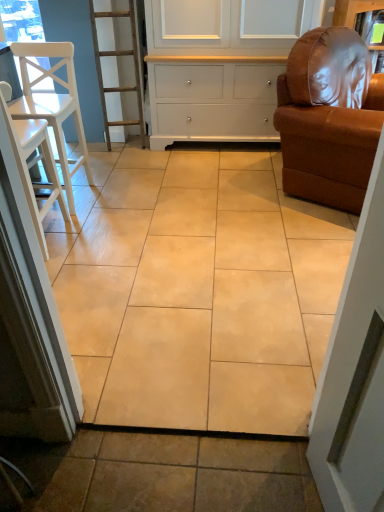
What do you see at coordinates (219, 65) in the screenshot?
I see `white painted wood cabinet at upper center` at bounding box center [219, 65].

Image resolution: width=384 pixels, height=512 pixels. Describe the element at coordinates (34, 163) in the screenshot. I see `white wood chair at left, the second chair viewed from the right` at that location.

Identify the location of beige ceramic tile at center. The height and width of the screenshot is (512, 384). (200, 293).

What are the coordinates of `white painted wood cabinet at upper center` in the screenshot? It's located at (219, 65).

Which of these two, beige ceramic tile at center or white painted wood cabinet at upper center, is thinner?

With smaller width is white painted wood cabinet at upper center.

Is white painted wood cabinet at upper center located within beige ceramic tile at center?

No, white painted wood cabinet at upper center is not a part of beige ceramic tile at center.

Is beige ceramic tile at center closer to the viewer compared to white painted wood cabinet at upper center?

Yes, beige ceramic tile at center is in front of white painted wood cabinet at upper center.

Considering the positions of objects white wood chair at left, which is counted as the 1th chair, starting from the left, and brown leather armchair at right, placed as the 1th chair when sorted from right to left, in the image provided, who is more to the left, white wood chair at left, which is counted as the 1th chair, starting from the left, or brown leather armchair at right, placed as the 1th chair when sorted from right to left,?

white wood chair at left, which is counted as the 1th chair, starting from the left, is more to the left.

Consider the image. Considering the sizes of objects white wood chair at left, which is counted as the 1th chair, starting from the left, and brown leather armchair at right, placed as the 1th chair when sorted from right to left, in the image provided, who is thinner, white wood chair at left, which is counted as the 1th chair, starting from the left, or brown leather armchair at right, placed as the 1th chair when sorted from right to left,?

white wood chair at left, which is counted as the 1th chair, starting from the left.

Is point (42, 47) closer or farther from the camera than point (317, 170)?

Point (42, 47).

Does white wood chair at left, the 3th chair from the right, lie behind brown leather armchair at right, the third chair in the left-to-right sequence?

That is True.

Is white wood chair at left, the second chair when ordered from left to right, far away from white painted wood cabinet at upper center?

Yes, white wood chair at left, the second chair when ordered from left to right, and white painted wood cabinet at upper center are located far from each other.

From the image's perspective, is white wood chair at left, the second chair when ordered from left to right, located beneath white painted wood cabinet at upper center?

Correct, white wood chair at left, the second chair when ordered from left to right, appears lower than white painted wood cabinet at upper center in the image.

Would you say white wood chair at left, the second chair viewed from the right, is to the left or to the right of white painted wood cabinet at upper center in the picture?

Based on their positions, white wood chair at left, the second chair viewed from the right, is located to the left of white painted wood cabinet at upper center.

Looking at this image, is white wood chair at left, the second chair when ordered from left to right, not inside white painted wood cabinet at upper center?

Yes, white wood chair at left, the second chair when ordered from left to right, is outside of white painted wood cabinet at upper center.

How distant is brown leather armchair at right, the third chair in the left-to-right sequence, from white wood chair at left, the 3th chair from the right?

brown leather armchair at right, the third chair in the left-to-right sequence, and white wood chair at left, the 3th chair from the right, are 4.92 feet apart.

In the scene shown: Which object is further away from the camera taking this photo, brown leather armchair at right, placed as the 1th chair when sorted from right to left, or white wood chair at left, the 3th chair from the right?

white wood chair at left, the 3th chair from the right, is further away from the camera.

Is brown leather armchair at right, the third chair in the left-to-right sequence, not within white wood chair at left, the 3th chair from the right?

brown leather armchair at right, the third chair in the left-to-right sequence, is positioned outside white wood chair at left, the 3th chair from the right.

Is point (306, 189) positioned behind point (59, 122)?

That is False.

From the image's perspective, which is below, white wood chair at left, the second chair viewed from the right, or brown leather armchair at right, the third chair in the left-to-right sequence?

white wood chair at left, the second chair viewed from the right, from the image's perspective.

Which object is further away from the camera, white wood chair at left, the second chair viewed from the right, or brown leather armchair at right, the third chair in the left-to-right sequence?

brown leather armchair at right, the third chair in the left-to-right sequence, is more distant.

Is white wood chair at left, the second chair viewed from the right, next to brown leather armchair at right, placed as the 1th chair when sorted from right to left, and touching it?

There is a gap between white wood chair at left, the second chair viewed from the right, and brown leather armchair at right, placed as the 1th chair when sorted from right to left.

Is beige ceramic tile at center in front of brown leather armchair at right, the third chair in the left-to-right sequence?

Yes, it is.

Choose the correct answer: Is beige ceramic tile at center inside brown leather armchair at right, placed as the 1th chair when sorted from right to left, or outside it?

beige ceramic tile at center lies outside brown leather armchair at right, placed as the 1th chair when sorted from right to left.

Does point (240, 375) lie in front of point (349, 80)?

Yes.

From the image's perspective, does beige ceramic tile at center appear higher than brown leather armchair at right, placed as the 1th chair when sorted from right to left?

No, from the image's perspective, beige ceramic tile at center is not over brown leather armchair at right, placed as the 1th chair when sorted from right to left.

Considering the sizes of brown leather armchair at right, placed as the 1th chair when sorted from right to left, and beige ceramic tile at center in the image, is brown leather armchair at right, placed as the 1th chair when sorted from right to left, taller or shorter than beige ceramic tile at center?

Clearly, brown leather armchair at right, placed as the 1th chair when sorted from right to left, is taller compared to beige ceramic tile at center.

Consider the image. Which is more to the right, brown leather armchair at right, placed as the 1th chair when sorted from right to left, or beige ceramic tile at center?

brown leather armchair at right, placed as the 1th chair when sorted from right to left, is more to the right.

Can you confirm if brown leather armchair at right, the third chair in the left-to-right sequence, is wider than beige ceramic tile at center?

No.

How different are the orientations of brown leather armchair at right, placed as the 1th chair when sorted from right to left, and beige ceramic tile at center in degrees?

They differ by 149 degrees in their facing directions.

Identify the location of cabinetry behind the beige ceramic tile at center. (219, 65).

From the white wood chair at left, the 3th chair from the right, count 2nd chair to the right and point to it. Please provide its 2D coordinates.

[(329, 118)]

Based on their spatial positions, is beige ceramic tile at center or brown leather armchair at right, placed as the 1th chair when sorted from right to left, closer to white wood chair at left, the 3th chair from the right?

beige ceramic tile at center lies closer to white wood chair at left, the 3th chair from the right, than the other object.

Consider the image. Based on their spatial positions, is white painted wood cabinet at upper center or brown leather armchair at right, placed as the 1th chair when sorted from right to left, further from white wood chair at left, the second chair viewed from the right?

brown leather armchair at right, placed as the 1th chair when sorted from right to left, is further to white wood chair at left, the second chair viewed from the right.

Based on their spatial positions, is white wood chair at left, the 3th chair from the right, or brown leather armchair at right, placed as the 1th chair when sorted from right to left, further from beige ceramic tile at center?

Among the two, white wood chair at left, the 3th chair from the right, is located further to beige ceramic tile at center.

Looking at the image, which one is located closer to brown leather armchair at right, placed as the 1th chair when sorted from right to left, beige ceramic tile at center or white painted wood cabinet at upper center?

beige ceramic tile at center.

Consider the image. Considering their positions, is brown leather armchair at right, placed as the 1th chair when sorted from right to left, positioned closer to beige ceramic tile at center than white painted wood cabinet at upper center?

Among the two, brown leather armchair at right, placed as the 1th chair when sorted from right to left, is located nearer to beige ceramic tile at center.

Looking at the image, which one is located further to brown leather armchair at right, the third chair in the left-to-right sequence, beige ceramic tile at center or white wood chair at left, the 3th chair from the right?

white wood chair at left, the 3th chair from the right, lies further to brown leather armchair at right, the third chair in the left-to-right sequence, than the other object.

From the image, which object appears to be farther from white wood chair at left, the 3th chair from the right, beige ceramic tile at center or white wood chair at left, the second chair viewed from the right?

beige ceramic tile at center lies further to white wood chair at left, the 3th chair from the right, than the other object.

Based on their spatial positions, is white painted wood cabinet at upper center or beige ceramic tile at center closer to white wood chair at left, which is counted as the 1th chair, starting from the left?

beige ceramic tile at center.

Locate an element on the screen. ceramic tile situated between white wood chair at left, which is counted as the 1th chair, starting from the left, and brown leather armchair at right, placed as the 1th chair when sorted from right to left, from left to right is located at coordinates (200, 293).

At what (x,y) coordinates should I click in order to perform the action: click on chair situated between white wood chair at left, which is counted as the 1th chair, starting from the left, and beige ceramic tile at center from left to right. Please return your answer as a coordinate pair (x, y). Looking at the image, I should click on (34, 163).

You are a GUI agent. You are given a task and a screenshot of the screen. Output one action in this format:
    pyautogui.click(x=<x>, y=<y>)
    Task: Click on the ceramic tile between white wood chair at left, which is counted as the 1th chair, starting from the left, and white painted wood cabinet at upper center, in the horizontal direction
    
    Given the screenshot: What is the action you would take?
    pyautogui.click(x=200, y=293)

I want to click on ceramic tile located between white wood chair at left, the second chair when ordered from left to right, and brown leather armchair at right, placed as the 1th chair when sorted from right to left, in the left-right direction, so click(x=200, y=293).